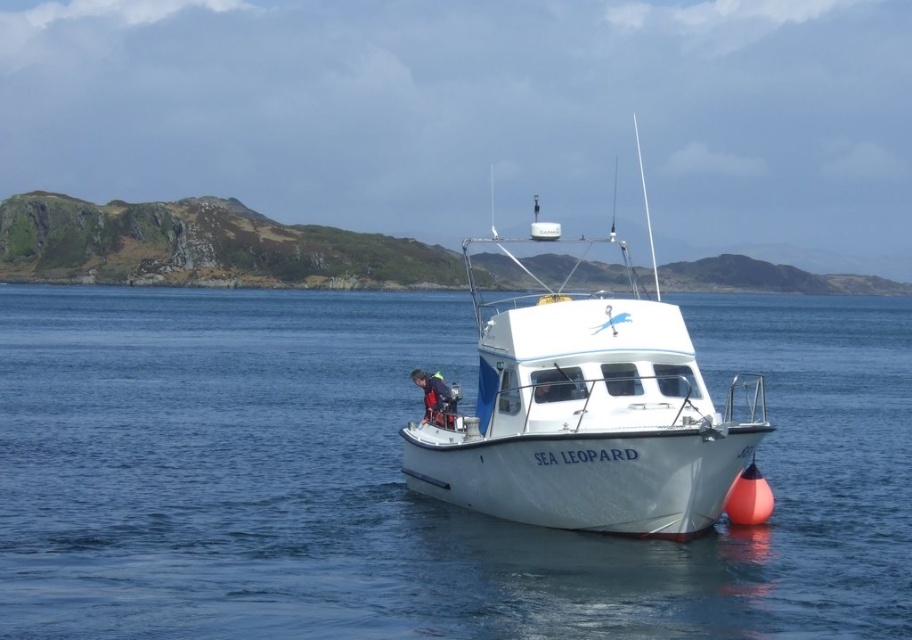
You are a photographer planning to take a photo of the white glossy boat at center and the blue fabric life jacket at center. Since you want both objects to appear equally prominent in the photo, which one should you zoom in on more?

The white glossy boat at center is larger in size than the blue fabric life jacket at center, so to make them appear equally prominent in the photo, you should zoom in more on the blue fabric life jacket at center to compensate for its smaller size.